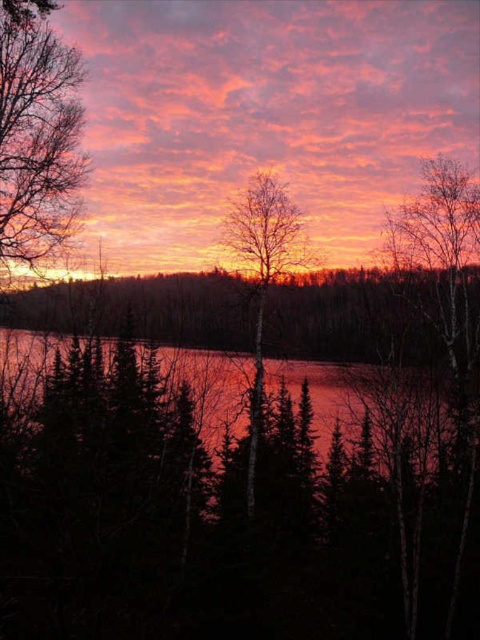
You are an observer standing at the lakeshore. You see the dark red water at center and the bare birch tree at center. Which object is closer to you?

The dark red water at center is closer to you because it is in front of the bare birch tree at center.

You are an artist painting the sunset scene. You want to paint the dark red water at center and the bare birch tree at center. Which object should you paint first if you follow the rule of painting background elements before foreground elements?

The dark red water at center should be painted first because it is positioned under the bare birch tree at center, indicating it is in the background.